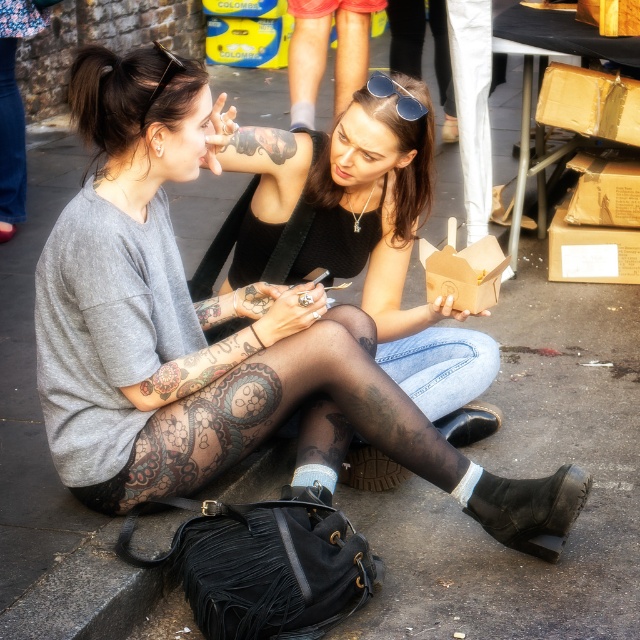
Question: Does black matte tights at center appear on the right side of sunglasses at center?

Choices:
 (A) no
 (B) yes

Answer: (A)

Question: Estimate the real-world distances between objects in this image. Which object is farther from the matte black sunglasses at upper center?

Choices:
 (A) matte black leggings at center
 (B) black matte tattoo at upper center
 (C) black matte tights at center

Answer: (A)

Question: Which point appears farthest from the camera in this image?

Choices:
 (A) (417, 115)
 (B) (232, 140)
 (C) (468, 371)
 (D) (314, 452)

Answer: (C)

Question: Which of these objects is positioned farthest from the black matte tights at center?

Choices:
 (A) matte black sunglasses at upper center
 (B) matte black leggings at center

Answer: (A)

Question: Can you confirm if matte black leggings at center is bigger than matte black sunglasses at upper center?

Choices:
 (A) yes
 (B) no

Answer: (A)

Question: From the image, what is the correct spatial relationship of matte black leggings at center in relation to black matte tattoo at upper center?

Choices:
 (A) below
 (B) above

Answer: (A)